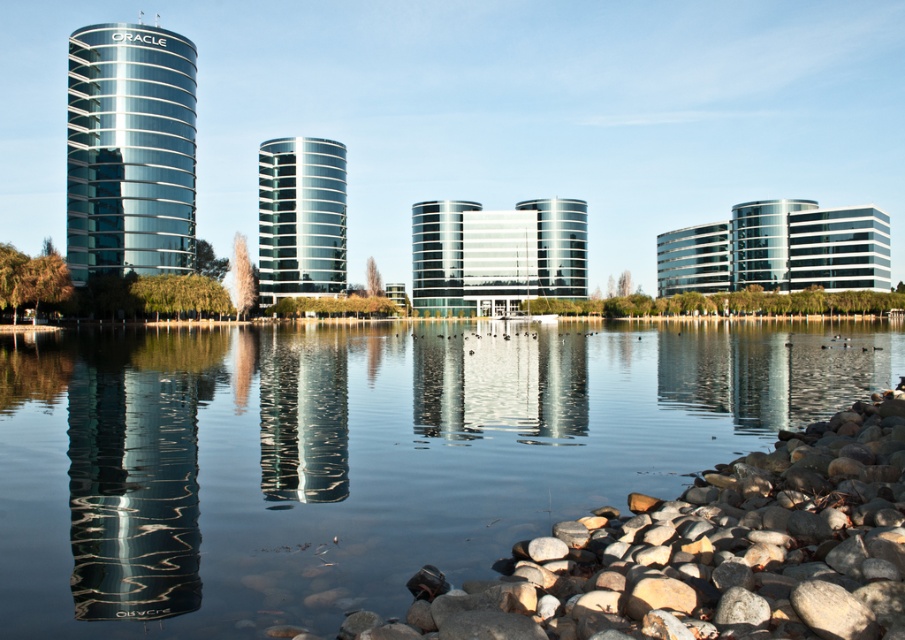
You are standing at the center of the rocky shoreline in the foreground of the image. You see a point marked at coordinates (134, 484). What object does this point correspond to?

The point at (134, 484) corresponds to the glossy glass building at left.

You are a photographer planning to capture the reflection of the glossy glass tower at left in the transparent water at center. Based on the scene, can the entire tower be reflected within the water?

The transparent water at center is wider than the glossy glass tower at left, so the entire tower can be reflected within the water.

You are standing at the edge of the water and want to place a small statue between the smooth gray rock at lower right and the glossy glass tower at left. Based on their positions, which object should you place the statue closer to if you want it to be nearer to the tower?

The statue should be placed closer to the glossy glass tower at left because the smooth gray rock at lower right is positioned to the right of the tower, so placing it near the tower would keep it closer to the structure.